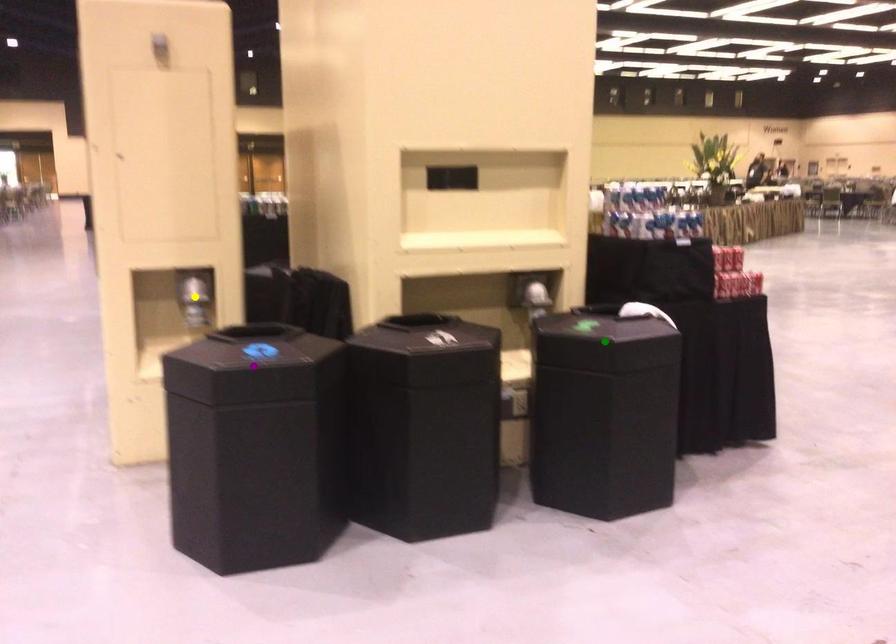
Order these from farthest to nearest:
yellow point
purple point
green point

yellow point
green point
purple point